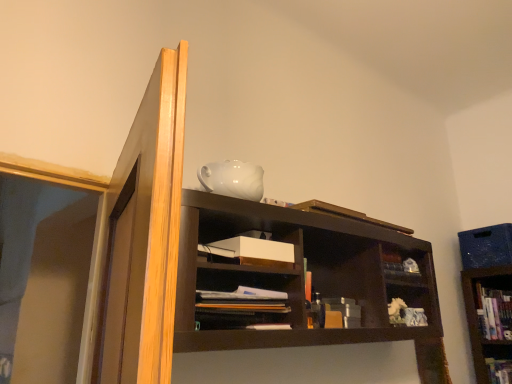
Question: From a real-world perspective, relative to matte brown books at center, is hardcover book at upper right, the first book from the back, vertically above or below?

Choices:
 (A) above
 (B) below

Answer: (A)

Question: From their relative heights in the image, would you say hardcover book at upper right, the first book from the back, is taller or shorter than matte brown books at center?

Choices:
 (A) short
 (B) tall

Answer: (B)

Question: Which is nearer to the hardcover book at upper right, which appears as the 2th book when viewed from the top?

Choices:
 (A) matte brown books at center
 (B) wooden book at upper center, which is counted as the first book, starting from the front
 (C) multicolored fabric book at upper center, the second book from the front
 (D) white matte paper at center

Answer: (C)

Question: Estimate the real-world distances between objects in this image. Which object is closer to the white matte paper at center?

Choices:
 (A) hardcover book at upper right, the first book from the back
 (B) multicolored fabric book at upper center, the second book from the front
 (C) wooden book at upper center, the 3th book when ordered from back to front
 (D) matte brown books at center

Answer: (D)